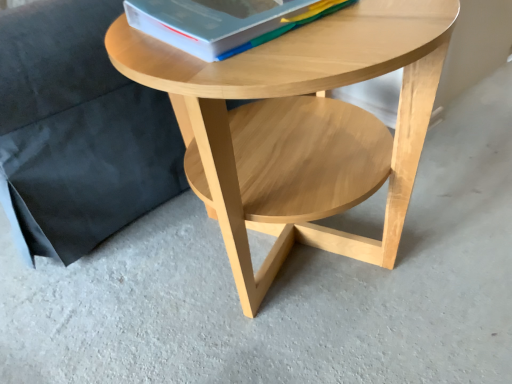
Question: Is matte wood armchair at upper left in front of hardcover book at upper center?

Choices:
 (A) no
 (B) yes

Answer: (A)

Question: Can you confirm if matte wood armchair at upper left is bigger than hardcover book at upper center?

Choices:
 (A) yes
 (B) no

Answer: (A)

Question: Is matte wood armchair at upper left further to camera compared to hardcover book at upper center?

Choices:
 (A) yes
 (B) no

Answer: (A)

Question: Can you confirm if matte wood armchair at upper left is positioned to the right of hardcover book at upper center?

Choices:
 (A) no
 (B) yes

Answer: (A)

Question: From the image's perspective, is matte wood armchair at upper left located beneath hardcover book at upper center?

Choices:
 (A) yes
 (B) no

Answer: (B)

Question: Would you say hardcover book at upper center is part of matte wood armchair at upper left's contents?

Choices:
 (A) yes
 (B) no

Answer: (B)

Question: From the image's perspective, is natural wood coffee table at center located above matte wood armchair at upper left?

Choices:
 (A) yes
 (B) no

Answer: (B)

Question: From a real-world perspective, is natural wood coffee table at center on top of matte wood armchair at upper left?

Choices:
 (A) no
 (B) yes

Answer: (A)

Question: From a real-world perspective, is natural wood coffee table at center located beneath matte wood armchair at upper left?

Choices:
 (A) no
 (B) yes

Answer: (B)

Question: Is natural wood coffee table at center not close to matte wood armchair at upper left?

Choices:
 (A) yes
 (B) no

Answer: (B)

Question: Is natural wood coffee table at center shorter than matte wood armchair at upper left?

Choices:
 (A) no
 (B) yes

Answer: (B)

Question: Is natural wood coffee table at center outside of matte wood armchair at upper left?

Choices:
 (A) no
 (B) yes

Answer: (B)

Question: Is hardcover book at upper center not near natural wood coffee table at center?

Choices:
 (A) no
 (B) yes

Answer: (A)